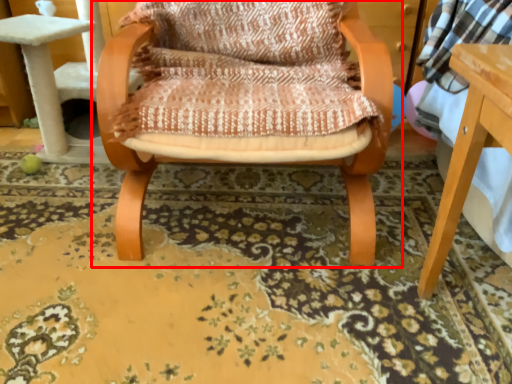
Question: From the image's perspective, where is chair (annotated by the red box) located in relation to mat in the image?

Choices:
 (A) below
 (B) above

Answer: (B)